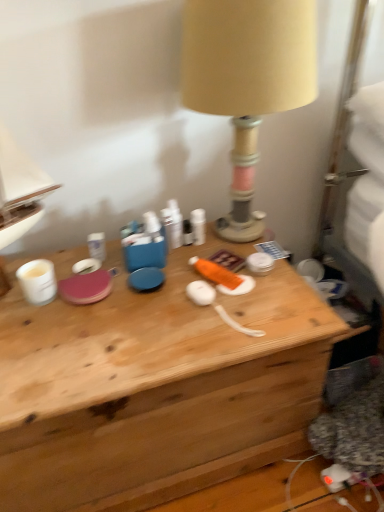
You are a GUI agent. You are given a task and a screenshot of the screen. Output one action in this format:
    pyautogui.click(x=<x>, y=<y>)
    Task: Click on the beige fabric lampshade at upper center
    Image resolution: width=384 pixels, height=512 pixels.
    Given the screenshot: What is the action you would take?
    click(x=247, y=79)

This screenshot has height=512, width=384. What do you see at coordinates (247, 79) in the screenshot?
I see `beige fabric lampshade at upper center` at bounding box center [247, 79].

The height and width of the screenshot is (512, 384). In order to click on wooden desk at center in this screenshot , I will do [x=155, y=388].

Image resolution: width=384 pixels, height=512 pixels. What do you see at coordinates (155, 388) in the screenshot?
I see `wooden desk at center` at bounding box center [155, 388].

Image resolution: width=384 pixels, height=512 pixels. In order to click on beige fabric lampshade at upper center in this screenshot , I will do `click(247, 79)`.

Is beige fabric lampshade at upper center at the right side of wooden desk at center?

Yes.

Is beige fabric lampshade at upper center positioned in front of wooden desk at center?

No, beige fabric lampshade at upper center is further to the viewer.

Considering the positions of point (204, 98) and point (10, 410), is point (204, 98) closer or farther from the camera than point (10, 410)?

Point (204, 98) appears to be farther away from the viewer than point (10, 410).

From the image's perspective, is beige fabric lampshade at upper center above or below wooden desk at center?

beige fabric lampshade at upper center is situated higher than wooden desk at center in the image.

From a real-world perspective, between beige fabric lampshade at upper center and wooden desk at center, who is vertically lower?

wooden desk at center is physically lower.

Is beige fabric lampshade at upper center wider or thinner than wooden desk at center?

Clearly, beige fabric lampshade at upper center has less width compared to wooden desk at center.

From their relative heights in the image, would you say beige fabric lampshade at upper center is taller or shorter than wooden desk at center?

In the image, beige fabric lampshade at upper center appears to be taller than wooden desk at center.

Does beige fabric lampshade at upper center have a smaller size compared to wooden desk at center?

Yes, beige fabric lampshade at upper center is smaller than wooden desk at center.

Is beige fabric lampshade at upper center completely or partially outside of wooden desk at center?

Yes.

Would you say beige fabric lampshade at upper center is a long distance from wooden desk at center?

That's not correct — beige fabric lampshade at upper center is a little close to wooden desk at center.

Could you tell me if beige fabric lampshade at upper center is facing wooden desk at center?

No, beige fabric lampshade at upper center is not oriented towards wooden desk at center.

Find the location of `lamp that is on the right side of wooden desk at center`. lamp that is on the right side of wooden desk at center is located at coordinates (247, 79).

Between wooden desk at center and beige fabric lampshade at upper center, which one appears on the left side from the viewer's perspective?

Positioned to the left is wooden desk at center.

Considering their positions, is wooden desk at center located in front of or behind beige fabric lampshade at upper center?

Clearly, wooden desk at center is in front of beige fabric lampshade at upper center.

Does point (308, 354) appear closer or farther from the camera than point (212, 42)?

Point (308, 354).

From the image's perspective, is wooden desk at center on beige fabric lampshade at upper center?

No, from the image's perspective, wooden desk at center is not above beige fabric lampshade at upper center.

From a real-world perspective, is wooden desk at center above or below beige fabric lampshade at upper center?

Clearly, from a real-world perspective, wooden desk at center is below beige fabric lampshade at upper center.

Which object is thinner, wooden desk at center or beige fabric lampshade at upper center?

beige fabric lampshade at upper center.

Can you confirm if wooden desk at center is shorter than beige fabric lampshade at upper center?

Yes.

Can you confirm if wooden desk at center is bigger than beige fabric lampshade at upper center?

Indeed, wooden desk at center has a larger size compared to beige fabric lampshade at upper center.

Is wooden desk at center situated inside beige fabric lampshade at upper center or outside?

wooden desk at center cannot be found inside beige fabric lampshade at upper center.

Is wooden desk at center not near beige fabric lampshade at upper center?

No, wooden desk at center is not far from beige fabric lampshade at upper center.

Could you tell me if wooden desk at center is facing beige fabric lampshade at upper center?

No.

You are a GUI agent. You are given a task and a screenshot of the screen. Output one action in this format:
    pyautogui.click(x=<x>, y=<y>)
    Task: Click on the desk below the beige fabric lampshade at upper center (from the image's perspective)
    
    Given the screenshot: What is the action you would take?
    pyautogui.click(x=155, y=388)

You are a GUI agent. You are given a task and a screenshot of the screen. Output one action in this format:
    pyautogui.click(x=<x>, y=<y>)
    Task: Click on the desk in front of the beige fabric lampshade at upper center
    The height and width of the screenshot is (512, 384).
    Given the screenshot: What is the action you would take?
    pyautogui.click(x=155, y=388)

Identify the location of desk on the left of beige fabric lampshade at upper center. (155, 388).